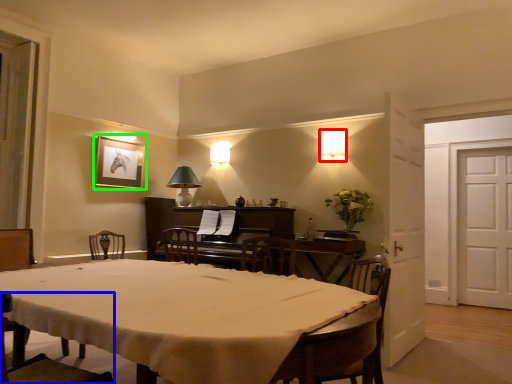
Question: Which object is positioned closest to lamp (highlighted by a red box)? Select from chair (highlighted by a blue box) and picture frame (highlighted by a green box).

Choices:
 (A) chair
 (B) picture frame

Answer: (B)